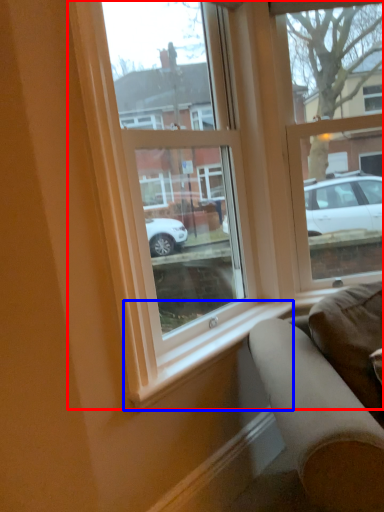
Question: Among these objects, which one is farthest to the camera, window (highlighted by a red box) or window sill (highlighted by a blue box)?

Choices:
 (A) window
 (B) window sill

Answer: (B)